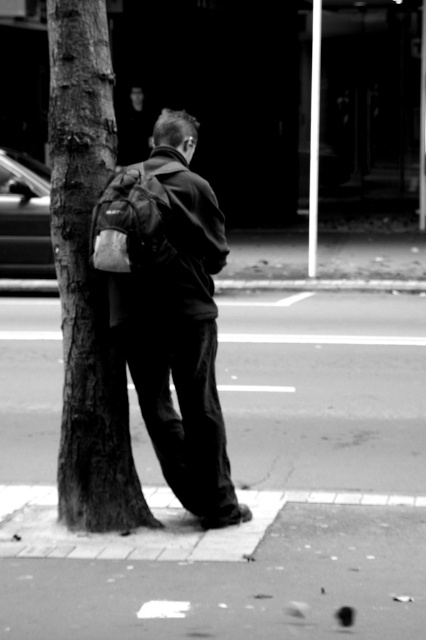
You are a delivery person trying to place a package on the ground. The package is the size of the matte black backpack at left. Can you fit it on the smooth concrete pavement at center without it overlapping the edges?

The smooth concrete pavement at center is bigger than the matte black backpack at left, so yes, the package can fit on the smooth concrete pavement at center without overlapping the edges.

Based on the scene described, which object occupies more horizontal space in the image? Please consider the smooth concrete pavement at center and the smooth bark tree at center in your answer.

The smooth concrete pavement at center might be wider than smooth bark tree at center according to the description.